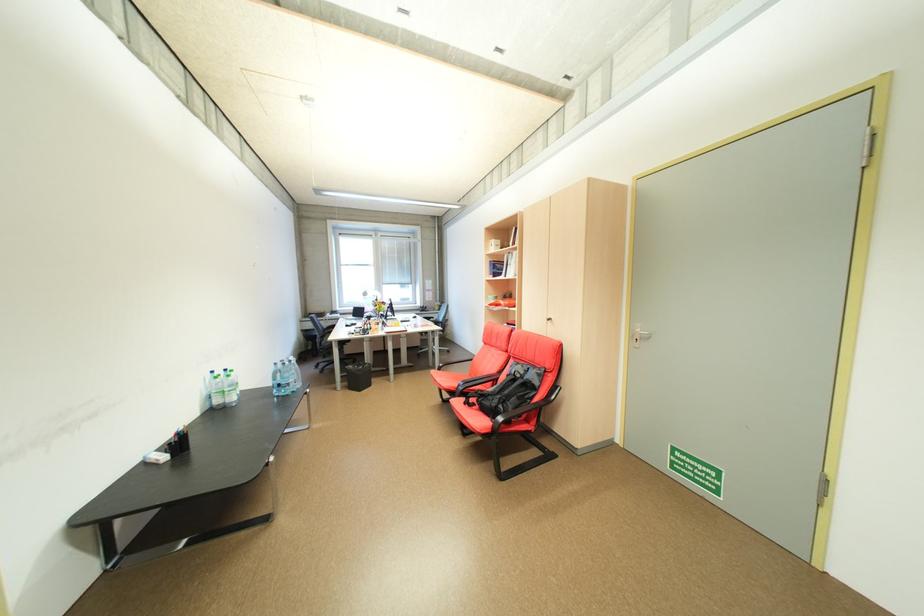
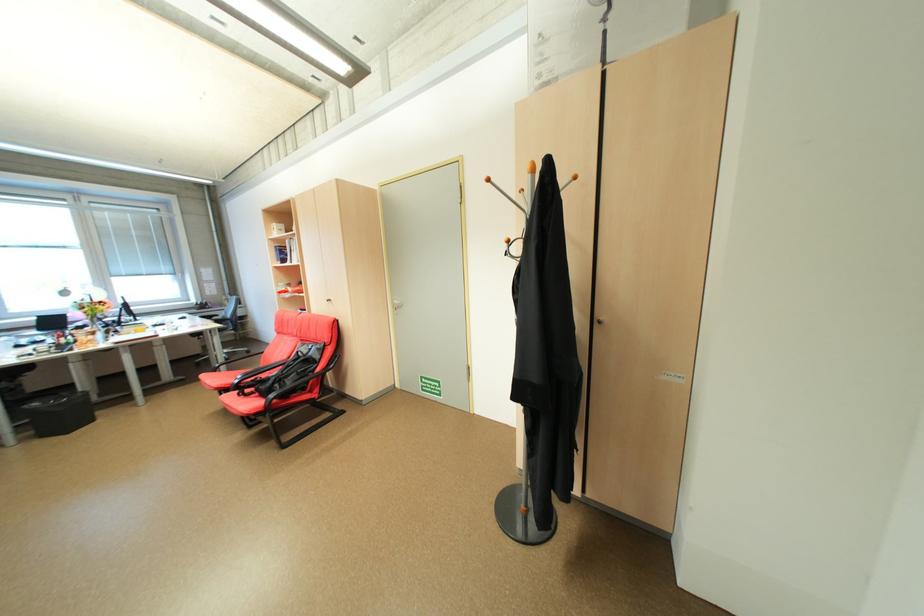
Locate, in the second image, the point that corresponds to (x=509, y=407) in the first image.

(286, 386)